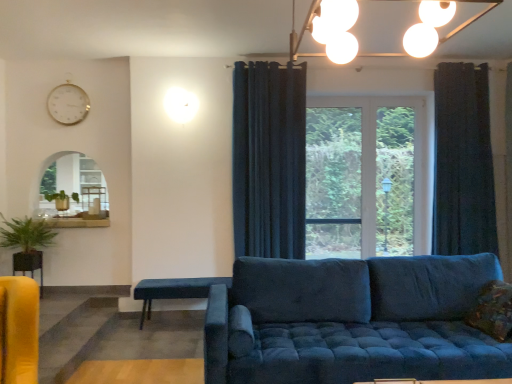
Question: Is dark blue fabric curtain at center, placed as the first curtain when sorted from left to right, inside or outside of matte white table at left, the 3th table in the bottom-to-top sequence?

Choices:
 (A) outside
 (B) inside

Answer: (A)

Question: From the image's perspective, is dark blue fabric curtain at center, placed as the first curtain when sorted from left to right, located above or below matte white table at left, which is counted as the second table, starting from the left?

Choices:
 (A) below
 (B) above

Answer: (B)

Question: Estimate the real-world distances between objects in this image. Which object is closer to the matte yellow table at lower left, which appears as the second table when ordered from the bottom?

Choices:
 (A) matte white table at left, the 1th table when ordered from back to front
 (B) dark blue fabric curtain at center, the second curtain positioned from the right
 (C) velvet blue studio couch at center
 (D) green leafy plant at left
 (E) textured brown pillow at lower right

Answer: (D)

Question: Based on their relative distances, which object is nearer to the matte yellow table at lower left, the second table when ordered from front to back?

Choices:
 (A) matte blue bench at center, which appears as the 3th table when viewed from the back
 (B) matte white table at left, which is counted as the second table, starting from the left
 (C) textured brown pillow at lower right
 (D) white glossy clock at upper left
 (E) dark blue fabric curtain at center, placed as the first curtain when sorted from left to right

Answer: (B)